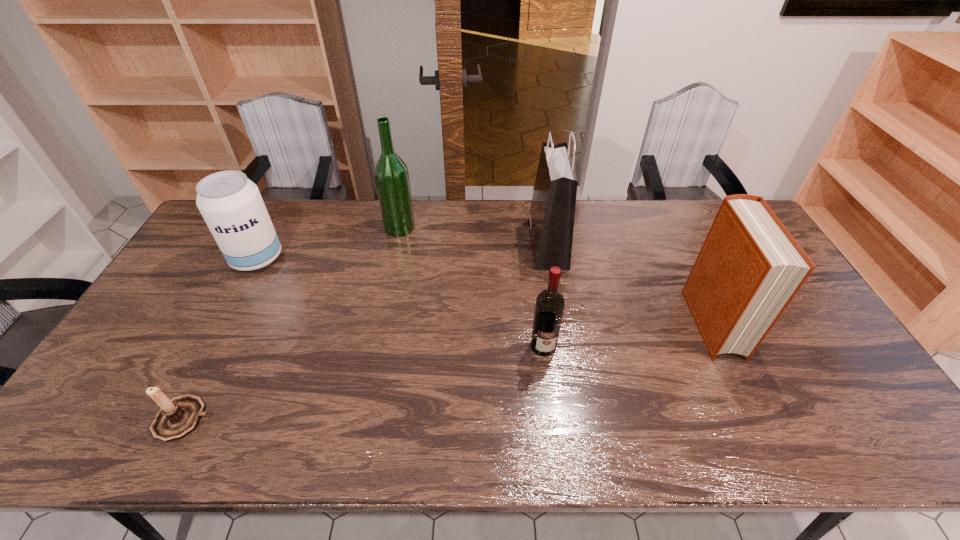
You are a GUI agent. You are given a task and a screenshot of the screen. Output one action in this format:
    pyautogui.click(x=<x>, y=<y>)
    Task: Click on the object identified as the fourth closest to the hardback book
    This screenshot has height=540, width=960.
    Given the screenshot: What is the action you would take?
    pyautogui.click(x=178, y=417)

Where is `the second closest alcohol to the shopping bag`? Image resolution: width=960 pixels, height=540 pixels. the second closest alcohol to the shopping bag is located at coordinates (391, 175).

This screenshot has width=960, height=540. Find the location of `alcohol that is the second closest to the nearest alcohol`. alcohol that is the second closest to the nearest alcohol is located at coordinates (231, 205).

What are the coordinates of `free space that satisfies the following two spatial constraints: 1. on the front side of the nearest object; 2. on the right side of the second farthest alcohol` in the screenshot? It's located at (173, 419).